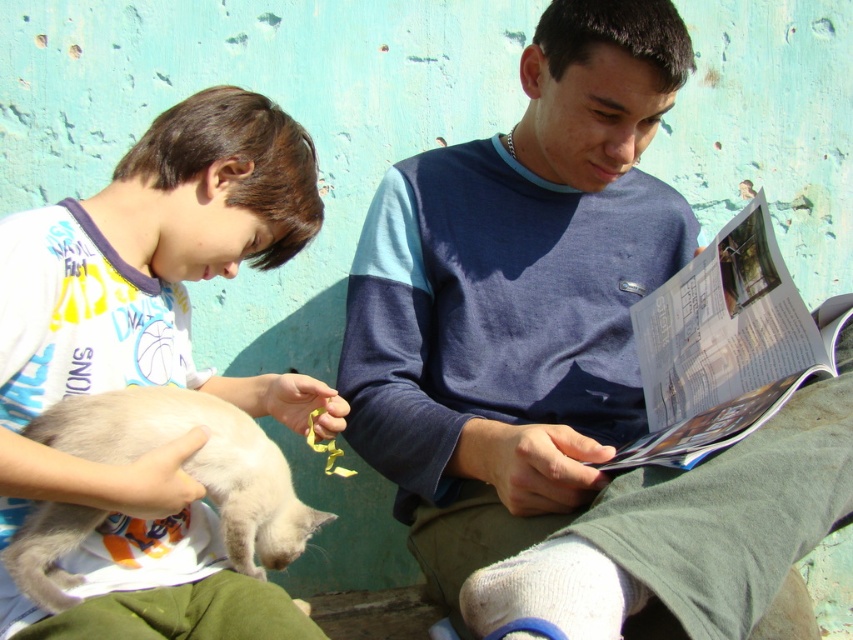
You are standing in front of the two people in the image. If you want to walk between them, which direction should you go relative to the two points labeled as point (201,376) and point (200,412)?

Since point (201,376) is behind point (200,412), you should walk towards the direction of point (200,412) to pass between them.

You are a photographer trying to capture a closeup of the blue cotton shirt at center and the white fur cat at lower left. Which object should you focus on first to ensure it appears sharp in the photo?

The blue cotton shirt at center is closer to the viewer than the white fur cat at lower left, so you should focus on the blue cotton shirt at center first to ensure it appears sharp in the photo.